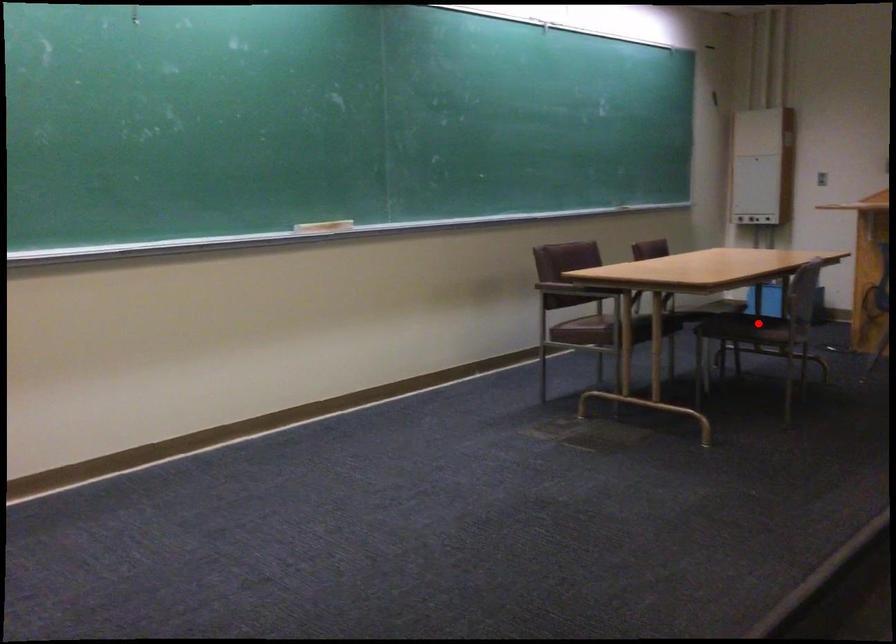
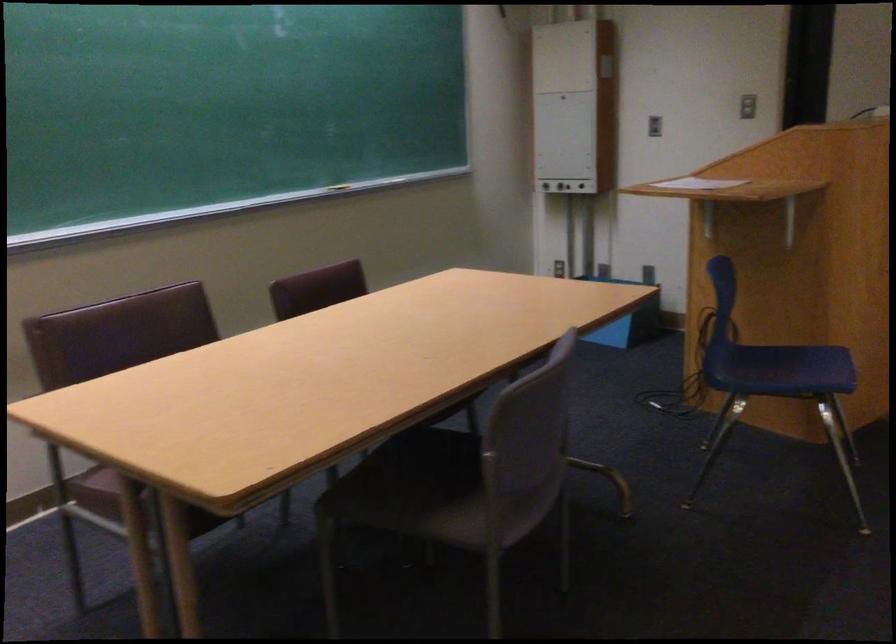
Question: I am providing you with two images of the same scene from different viewpoints. Image1 has a red point marked. In image2, the corresponding 3D location appears at what relative position? Reply with the corresponding letter.

Choices:
 (A) Closer
 (B) Farther

Answer: (A)